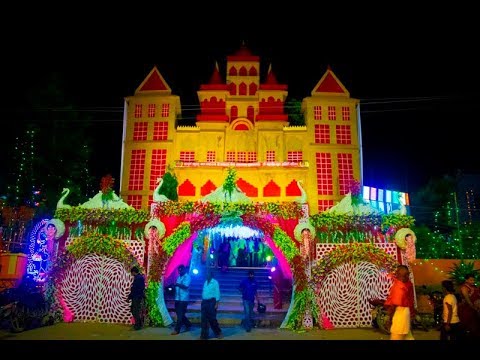
This screenshot has height=360, width=480. Find the location of `light`. light is located at coordinates (35, 254).